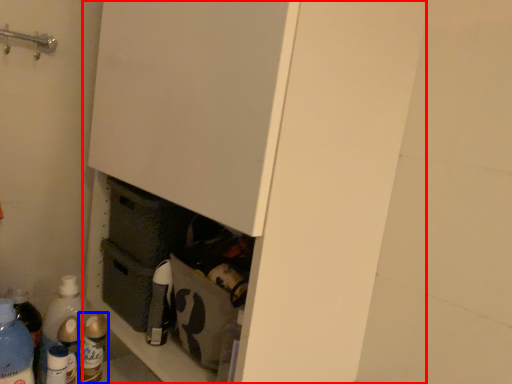
Question: Which object appears closest to the camera in this image, cupboard (highlighted by a red box) or bottle (highlighted by a blue box)?

Choices:
 (A) cupboard
 (B) bottle

Answer: (A)